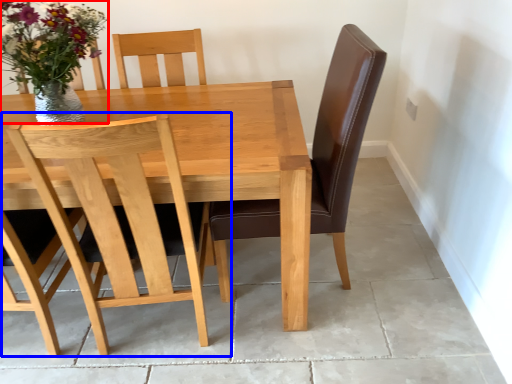
Question: Which object is further to the camera taking this photo, floral arrangement (highlighted by a red box) or chair (highlighted by a blue box)?

Choices:
 (A) floral arrangement
 (B) chair

Answer: (A)